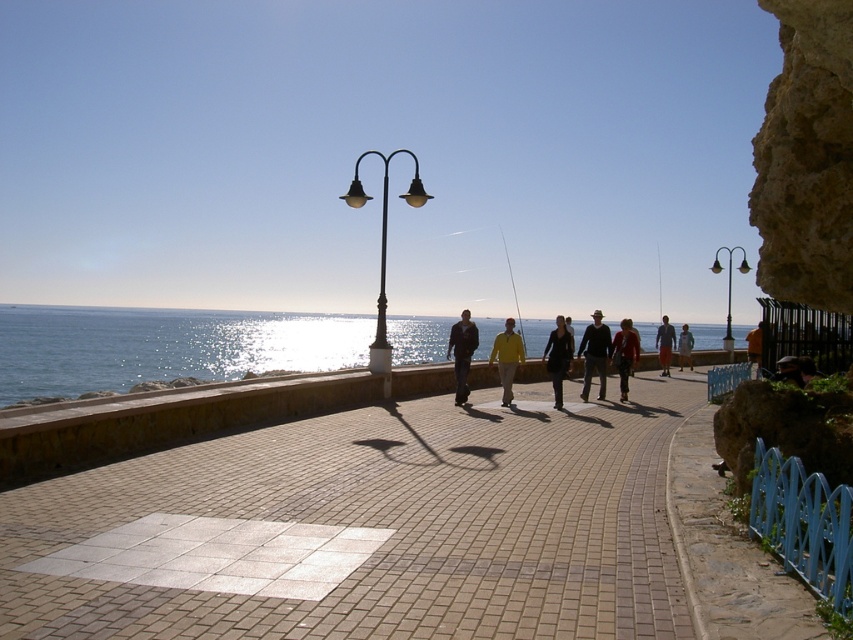
You are standing on the seaside promenade and want to walk towards the two points marked in the image. Which point, point (456,353) or point (517,321), is closer to you?

Point (456,353) is closer to the viewer than point (517,321).